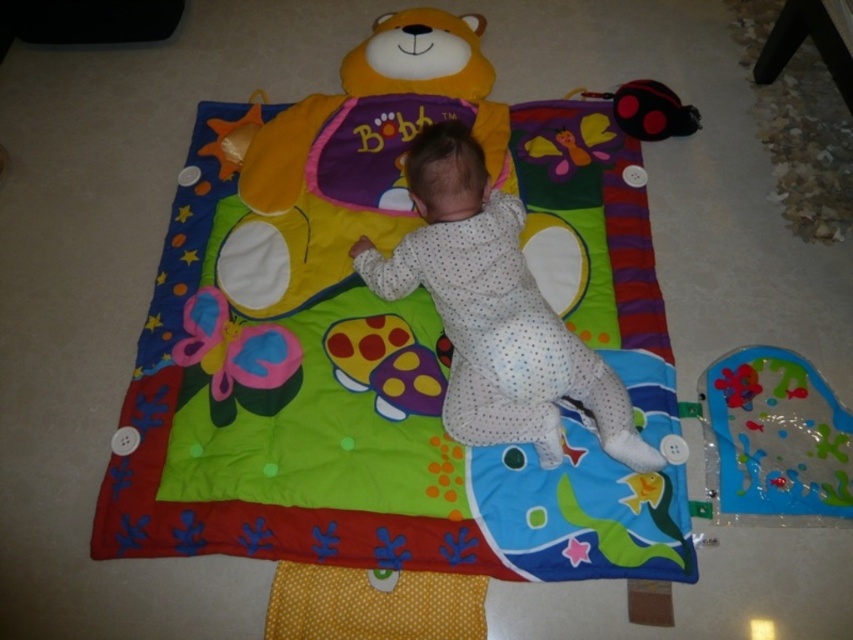
Can you confirm if matte plastic mushroom at center is positioned to the right of black rubber toy at upper right?

No, matte plastic mushroom at center is not to the right of black rubber toy at upper right.

Which of these two, matte plastic mushroom at center or black rubber toy at upper right, stands shorter?

black rubber toy at upper right is shorter.

Is point (392, 321) positioned before point (640, 116)?

Yes.

At what (x,y) coordinates should I click in order to perform the action: click on matte plastic mushroom at center. Please return your answer as a coordinate pair (x, y). This screenshot has width=853, height=640. Looking at the image, I should click on (387, 364).

Is point (782, 355) positioned before point (193, 385)?

No, (782, 355) is further to viewer.

How much distance is there between transparent plastic fish at lower right and matte plastic butterfly at center?

37.63 inches

What do you see at coordinates (775, 440) in the screenshot? I see `transparent plastic fish at lower right` at bounding box center [775, 440].

Locate an element on the screen. transparent plastic fish at lower right is located at coordinates (775, 440).

The image size is (853, 640). Describe the element at coordinates (338, 396) in the screenshot. I see `soft cotton play mat at center` at that location.

Who is more forward, (x=676, y=561) or (x=184, y=385)?

Point (x=676, y=561) is more forward.

Find the location of a particular element. soft cotton play mat at center is located at coordinates (338, 396).